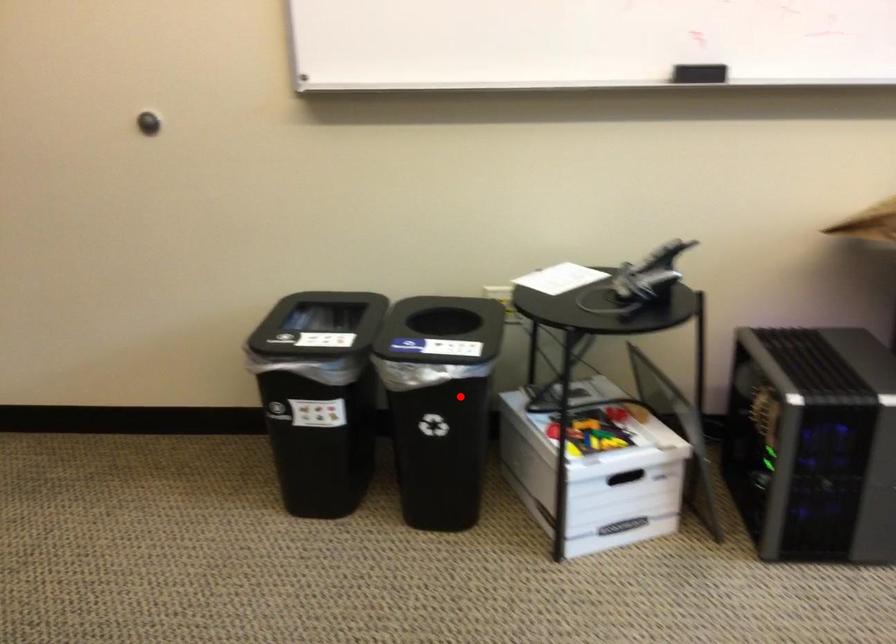
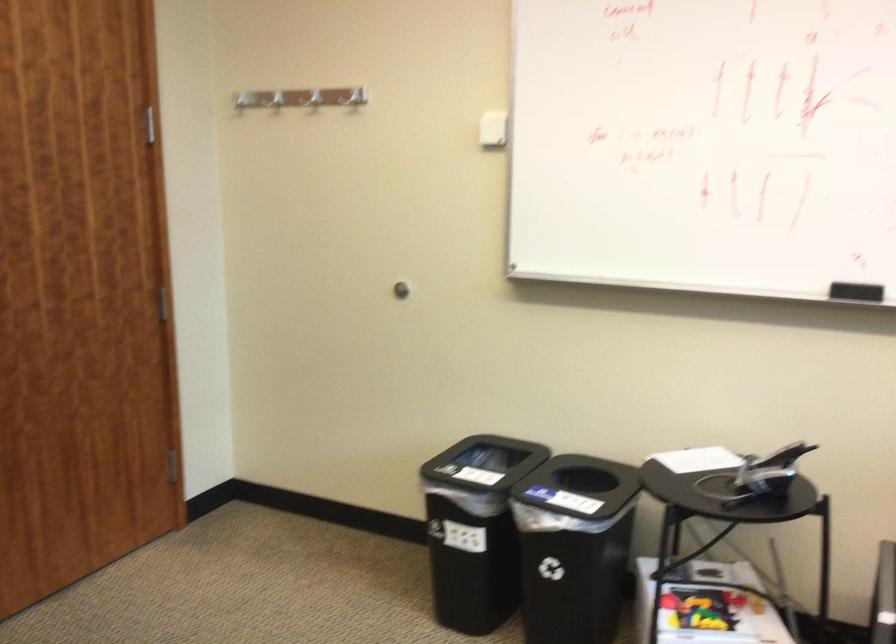
Question: I am providing you with two images of the same scene from different viewpoints. Image1 has a red point marked. In image2, the corresponding 3D location appears at what relative position? Reply with the corresponding letter.

Choices:
 (A) Closer
 (B) Farther

Answer: (B)